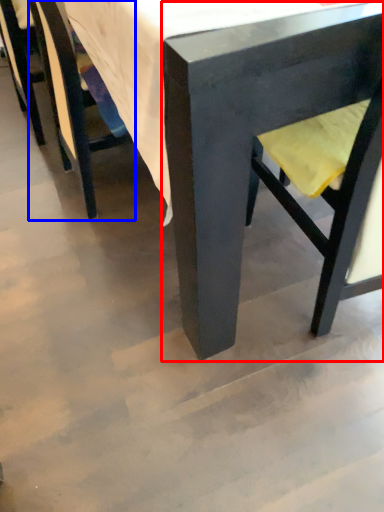
Question: Among these objects, which one is nearest to the camera, chair (highlighted by a red box) or chair (highlighted by a blue box)?

Choices:
 (A) chair
 (B) chair

Answer: (A)